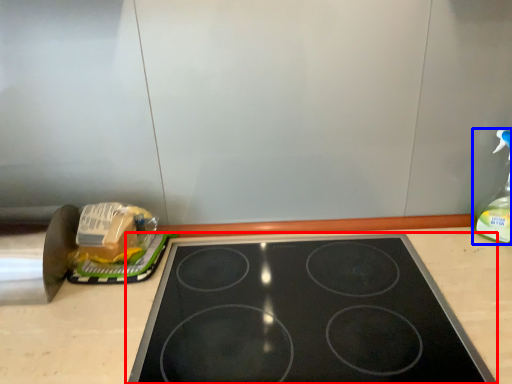
Question: Among these objects, which one is farthest to the camera, gas stove (highlighted by a red box) or bottle (highlighted by a blue box)?

Choices:
 (A) gas stove
 (B) bottle

Answer: (B)